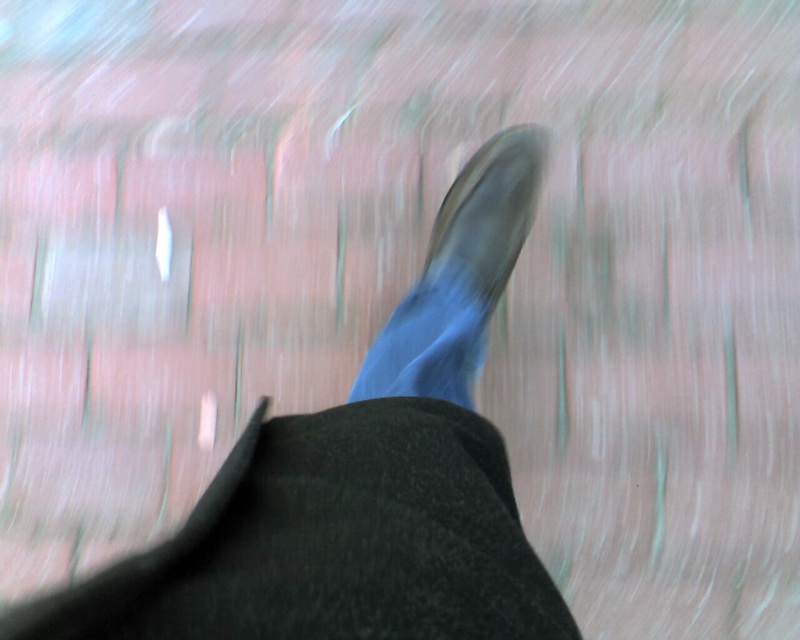
You are moving quickly and looking at the scene through your own eyes. You notice two points in the image, one at coordinates point (132, 557) and the other at point (401, 332). Which point is nearer to you?

Point (132, 557) is closer to the viewer than point (401, 332).

In the scene shown: You are a photographer trying to capture a clear image of both the shiny black shoe at center and the leather shoe at center in a motion blur photo. Given that the two shoes are 2.10 inches apart, what is the minimum distance you should keep between them to ensure both are visible without overlapping in the blur?

The minimum distance between the shiny black shoe at center and the leather shoe at center should be at least 2.10 inches to prevent overlapping in the motion blur.

You are a photographer analyzing a motion blur image. You notice two shoes at the center of the image, a shiny black shoe at center and a leather shoe at center. Which one appears taller in the photo?

The shiny black shoe at center is taller than the leather shoe at center according to the description.